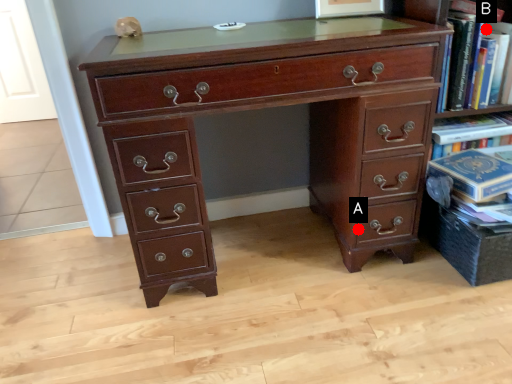
Question: Two points are circled on the image, labeled by A and B beside each circle. Which point is farther from the camera taking this photo?

Choices:
 (A) A is further
 (B) B is further

Answer: (B)